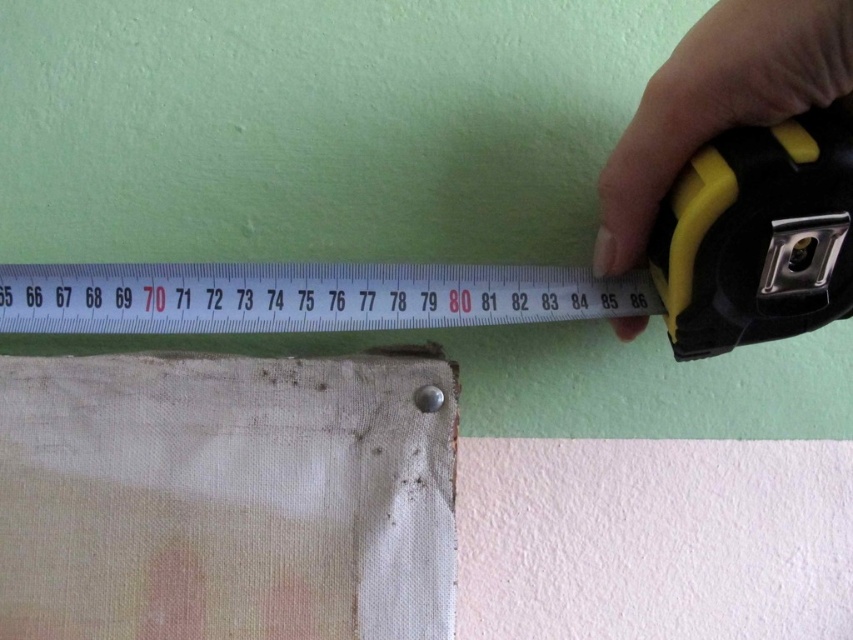
Question: Based on their relative distances, which object is farther from the white plastic ruler at upper center?

Choices:
 (A) yellow rubber tape measure at upper right
 (B) white fabric pocket at lower left

Answer: (A)

Question: Which point is farther to the camera?

Choices:
 (A) click(834, 77)
 (B) click(399, 490)

Answer: (B)

Question: Does white fabric pocket at lower left appear on the right side of yellow rubber tape measure at upper right?

Choices:
 (A) yes
 (B) no

Answer: (B)

Question: In this image, where is white fabric pocket at lower left located relative to yellow rubber tape measure at upper right?

Choices:
 (A) above
 (B) below

Answer: (B)

Question: Can you confirm if white fabric pocket at lower left is positioned to the right of white plastic ruler at upper center?

Choices:
 (A) yes
 (B) no

Answer: (B)

Question: Estimate the real-world distances between objects in this image. Which object is closer to the white fabric pocket at lower left?

Choices:
 (A) white plastic ruler at upper center
 (B) yellow rubber tape measure at upper right

Answer: (A)